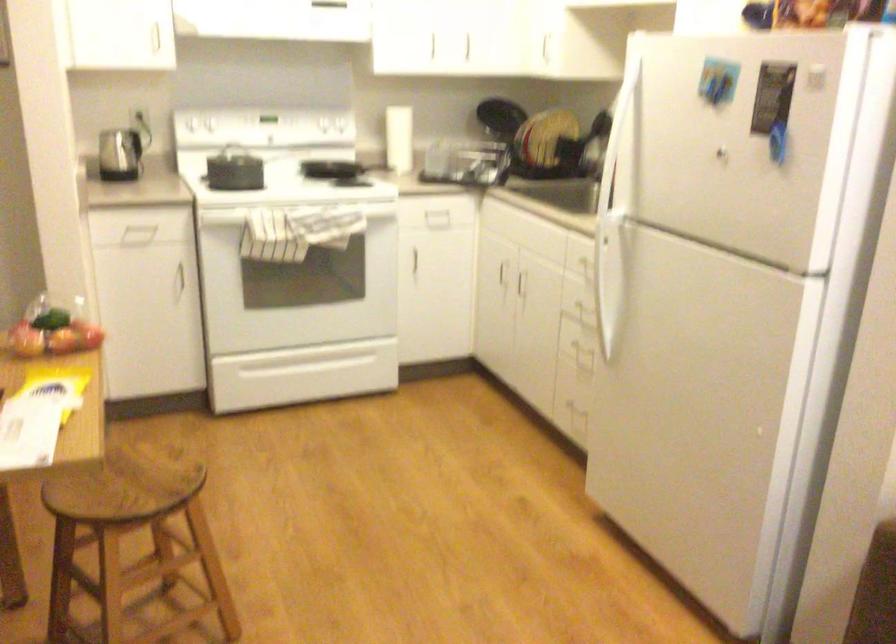
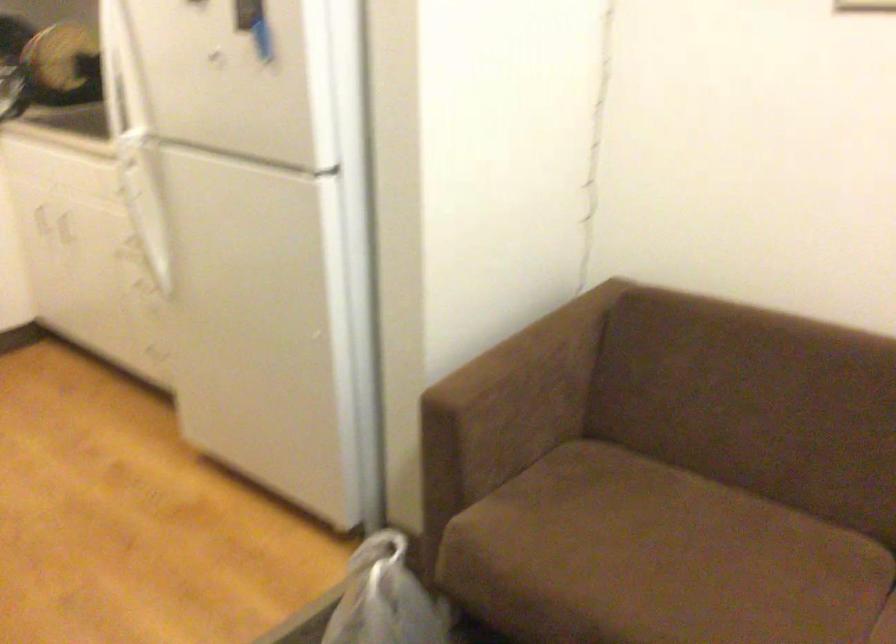
Question: In a continuous first-person perspective shot, in which direction is the camera moving?

Choices:
 (A) Left
 (B) Right
 (C) Forward
 (D) Backward

Answer: (B)